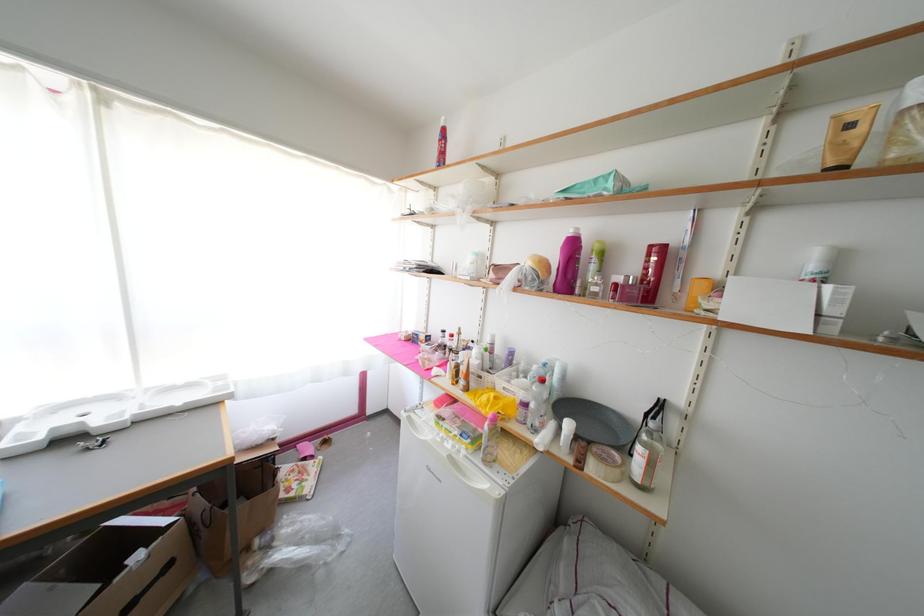
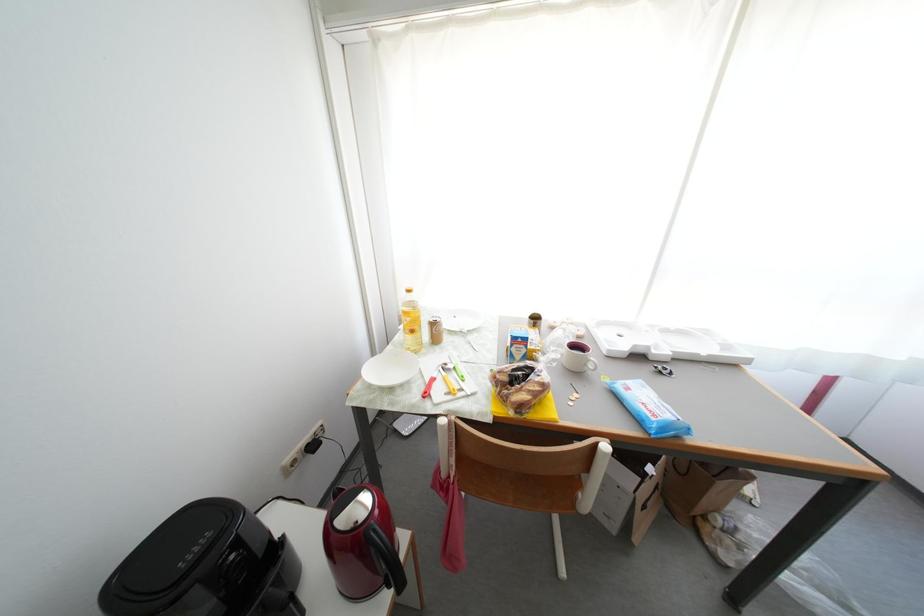
Question: The images are taken continuously from a first-person perspective. In which direction is your viewpoint rotating?

Choices:
 (A) Left
 (B) Right
 (C) Up
 (D) Down

Answer: (A)